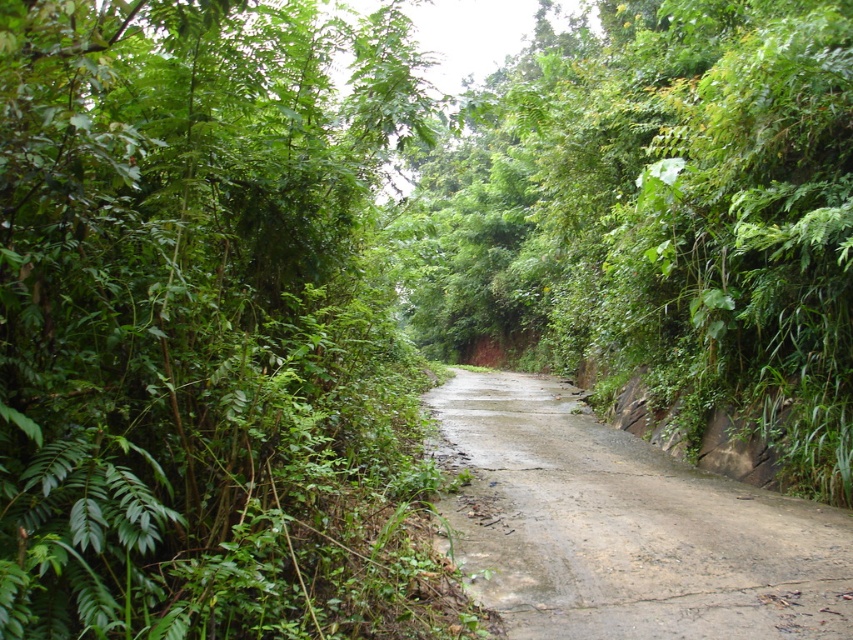
Can you confirm if green leafy tree at center is positioned to the right of dull gray concrete at center?

Incorrect, green leafy tree at center is not on the right side of dull gray concrete at center.

Which is above, green leafy tree at center or dull gray concrete at center?

green leafy tree at center is higher up.

Locate an element on the screen. green leafy tree at center is located at coordinates (665, 216).

Can you confirm if green leafy tree at left is thinner than dull gray concrete at center?

Indeed, green leafy tree at left has a lesser width compared to dull gray concrete at center.

Does green leafy tree at left have a smaller size compared to dull gray concrete at center?

No, green leafy tree at left is not smaller than dull gray concrete at center.

Between point (306, 188) and point (675, 556), which one is positioned in front?

Point (675, 556)

In order to click on green leafy tree at left in this screenshot , I will do `click(202, 326)`.

Does green leafy tree at left appear on the right side of green leafy tree at center?

In fact, green leafy tree at left is to the left of green leafy tree at center.

Can you confirm if green leafy tree at left is positioned to the left of green leafy tree at center?

Correct, you'll find green leafy tree at left to the left of green leafy tree at center.

In the scene shown: Who is more forward, (88, 435) or (584, 291)?

Positioned in front is point (88, 435).

Find the location of a particular element. The image size is (853, 640). green leafy tree at left is located at coordinates (202, 326).